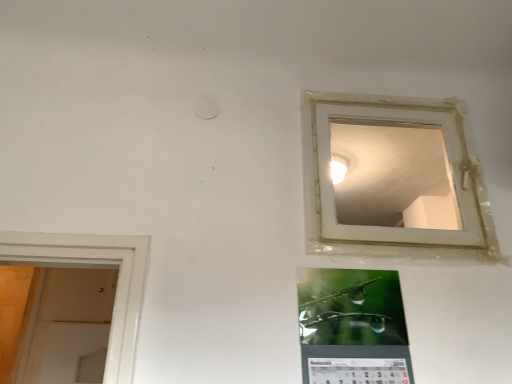
The width and height of the screenshot is (512, 384). Describe the element at coordinates (392, 177) in the screenshot. I see `transparent plastic window at upper right` at that location.

Where is `transparent plastic window at upper right`? The image size is (512, 384). transparent plastic window at upper right is located at coordinates (392, 177).

You are a GUI agent. You are given a task and a screenshot of the screen. Output one action in this format:
    pyautogui.click(x=<x>, y=<y>)
    Task: Click on the green glossy calendar at lower center
    Image resolution: width=512 pixels, height=384 pixels.
    Given the screenshot: What is the action you would take?
    pyautogui.click(x=352, y=327)

What do you see at coordinates (352, 327) in the screenshot? I see `green glossy calendar at lower center` at bounding box center [352, 327].

Identify the location of transparent plastic window at upper right. coord(392,177).

Does transparent plastic window at upper right appear on the left side of green glossy calendar at lower center?

No, transparent plastic window at upper right is not to the left of green glossy calendar at lower center.

Considering their positions, is transparent plastic window at upper right located in front of or behind green glossy calendar at lower center?

transparent plastic window at upper right is behind green glossy calendar at lower center.

In the scene shown: Which is nearer, (490, 239) or (369, 327)?

Point (490, 239) is positioned farther from the camera compared to point (369, 327).

Looking at this image, from the image's perspective, between transparent plastic window at upper right and green glossy calendar at lower center, which one is located above?

transparent plastic window at upper right, from the image's perspective.

From a real-world perspective, relative to green glossy calendar at lower center, is transparent plastic window at upper right vertically above or below?

From a real-world perspective, transparent plastic window at upper right is physically above green glossy calendar at lower center.

Which object is thinner, transparent plastic window at upper right or green glossy calendar at lower center?

Thinner between the two is transparent plastic window at upper right.

Considering the sizes of objects transparent plastic window at upper right and green glossy calendar at lower center in the image provided, who is shorter, transparent plastic window at upper right or green glossy calendar at lower center?

green glossy calendar at lower center is shorter.

Considering the sizes of objects transparent plastic window at upper right and green glossy calendar at lower center in the image provided, who is bigger, transparent plastic window at upper right or green glossy calendar at lower center?

Bigger between the two is transparent plastic window at upper right.

Is transparent plastic window at upper right situated inside green glossy calendar at lower center or outside?

transparent plastic window at upper right is spatially situated outside green glossy calendar at lower center.

Is transparent plastic window at upper right not close to green glossy calendar at lower center?

Indeed, transparent plastic window at upper right is not near green glossy calendar at lower center.

Is transparent plastic window at upper right aimed at green glossy calendar at lower center?

No, transparent plastic window at upper right is not aimed at green glossy calendar at lower center.

Measure the distance from transparent plastic window at upper right to green glossy calendar at lower center.

transparent plastic window at upper right is 1.14 meters from green glossy calendar at lower center.

At what (x,y) coordinates should I click in order to perform the action: click on bulletin board below the transparent plastic window at upper right (from the image's perspective). Please return your answer as a coordinate pair (x, y). The height and width of the screenshot is (384, 512). Looking at the image, I should click on (352, 327).

In the scene shown: Based on their positions, is green glossy calendar at lower center located to the left or right of transparent plastic window at upper right?

green glossy calendar at lower center is positioned on transparent plastic window at upper right's left side.

Which is in front, green glossy calendar at lower center or transparent plastic window at upper right?

green glossy calendar at lower center.

Considering the points (339, 318) and (371, 141), which point is in front, point (339, 318) or point (371, 141)?

The point (339, 318) is in front.

From the image's perspective, is green glossy calendar at lower center located above transparent plastic window at upper right?

Incorrect, from the image's perspective, green glossy calendar at lower center is lower than transparent plastic window at upper right.

From a real-world perspective, is green glossy calendar at lower center physically located above or below transparent plastic window at upper right?

From a real-world perspective, green glossy calendar at lower center is physically below transparent plastic window at upper right.

Based on the photo, does green glossy calendar at lower center have a lesser width compared to transparent plastic window at upper right?

Incorrect, the width of green glossy calendar at lower center is not less than that of transparent plastic window at upper right.

Is green glossy calendar at lower center shorter than transparent plastic window at upper right?

Correct, green glossy calendar at lower center is not as tall as transparent plastic window at upper right.

Does green glossy calendar at lower center have a smaller size compared to transparent plastic window at upper right?

Indeed, green glossy calendar at lower center has a smaller size compared to transparent plastic window at upper right.

Is transparent plastic window at upper right a part of green glossy calendar at lower center?

No, green glossy calendar at lower center does not contain transparent plastic window at upper right.

Is green glossy calendar at lower center directly adjacent to transparent plastic window at upper right?

green glossy calendar at lower center and transparent plastic window at upper right are clearly separated.

Is green glossy calendar at lower center looking in the opposite direction of transparent plastic window at upper right?

No, green glossy calendar at lower center is not facing the opposite direction of transparent plastic window at upper right.

How many degrees apart are the facing directions of green glossy calendar at lower center and transparent plastic window at upper right?

0.000681 degrees separate the facing orientations of green glossy calendar at lower center and transparent plastic window at upper right.

Measure the distance from green glossy calendar at lower center to transparent plastic window at upper right.

A distance of 3.74 feet exists between green glossy calendar at lower center and transparent plastic window at upper right.

Identify the location of bulletin board on the left of transparent plastic window at upper right. This screenshot has height=384, width=512. (352, 327).

The image size is (512, 384). Find the location of `window on the right of green glossy calendar at lower center`. window on the right of green glossy calendar at lower center is located at coordinates (392, 177).

Find the location of a particular element. Image resolution: width=512 pixels, height=384 pixels. window above the green glossy calendar at lower center (from a real-world perspective) is located at coordinates (392, 177).